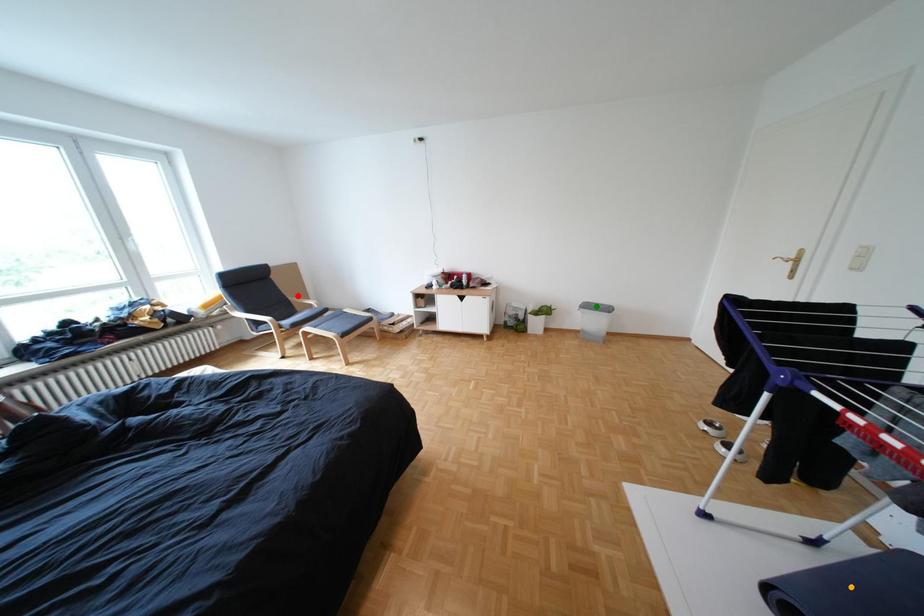
Order these from nearest to farthest:
red point, orange point, green point

1. orange point
2. green point
3. red point